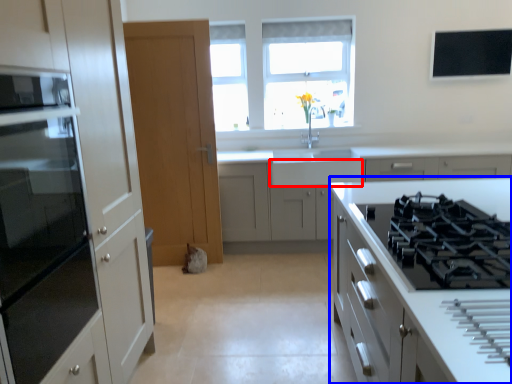
Question: Which of the following is the farthest to the observer, drawer (highlighted by a red box) or cabinetry (highlighted by a blue box)?

Choices:
 (A) drawer
 (B) cabinetry

Answer: (A)